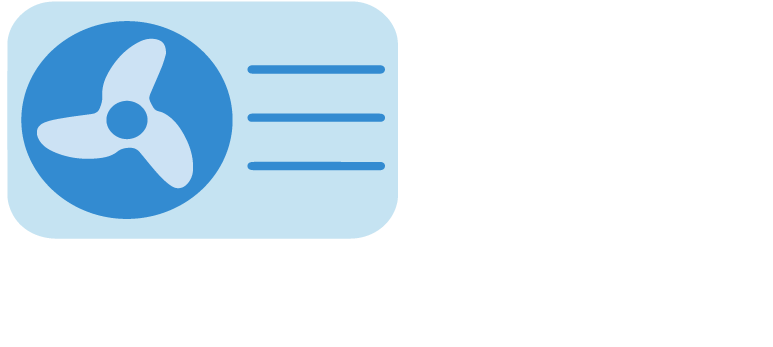
You are a GUI agent. You are given a task and a screenshot of the screen. Output one action in this format:
    pyautogui.click(x=<x>, y=<y>)
    Task: Click on the light gray cartoonish fans or propellors of fans
    
    Given the screenshot: What is the action you would take?
    pyautogui.click(x=89, y=141)